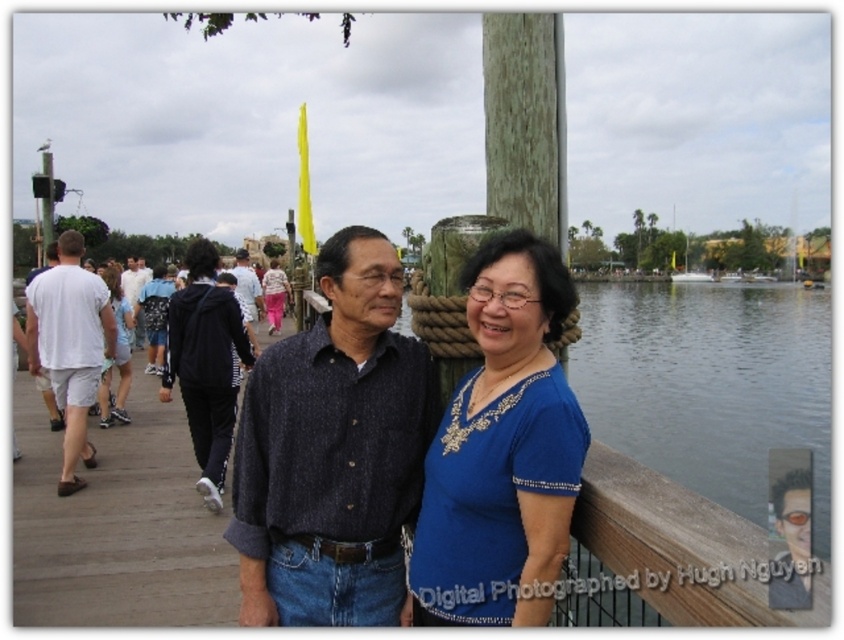
You are a photographer trying to capture a clear shot of both the dark blue textured shirt at center and the light blue fabric dress at left. Which clothing item is covering part of the other in the image?

The dark blue textured shirt at center is positioned over the light blue fabric dress at left, so it is covering part of it.

You are standing at the point with coordinates point (690, 602) and want to walk to the point with coordinates point (520, 497). Which direction should you move?

You should move backward because point (520, 497) is behind point (690, 602).